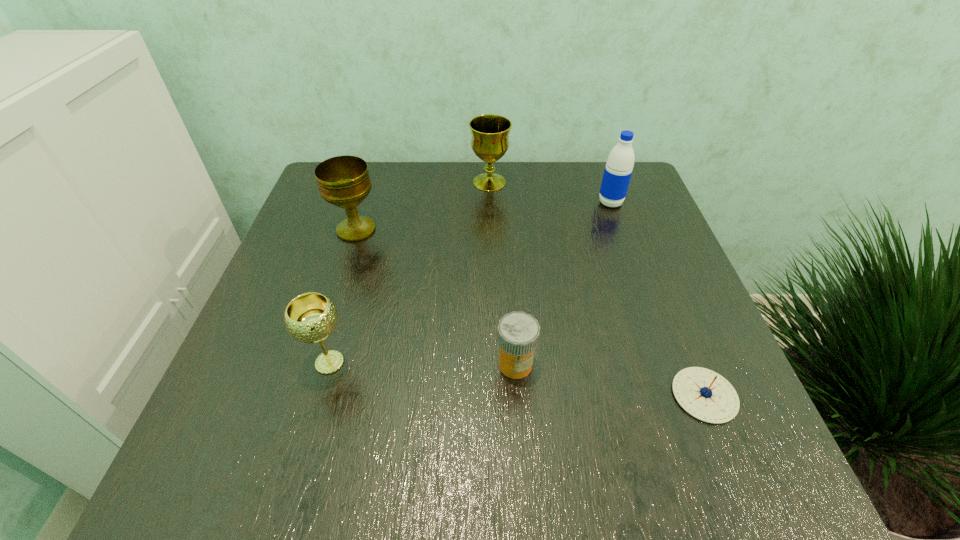
Identify the location of free space at the far right corner of the desktop. This screenshot has height=540, width=960. (590, 180).

Where is `free space between the medicine and the nearest chalice`? free space between the medicine and the nearest chalice is located at coordinates (422, 363).

Locate an element on the screen. The width and height of the screenshot is (960, 540). free space between the farthest chalice and the medicine is located at coordinates (502, 273).

Locate an element on the screen. This screenshot has height=540, width=960. vacant area between the compass and the rightmost chalice is located at coordinates (597, 288).

Where is `free spot between the second farthest object and the nearest chalice`? free spot between the second farthest object and the nearest chalice is located at coordinates (470, 282).

I want to click on vacant region between the water bottle and the medicine, so click(x=563, y=284).

I want to click on empty location between the water bottle and the fifth tallest object, so click(563, 284).

This screenshot has height=540, width=960. Identify the location of vacant space that is in between the fourth nearest object and the nearest chalice. (343, 296).

I want to click on free spot between the shortest object and the medicine, so click(x=610, y=380).

Where is `object that can be found as the closest to the second farthest chalice`? This screenshot has width=960, height=540. object that can be found as the closest to the second farthest chalice is located at coordinates (490, 141).